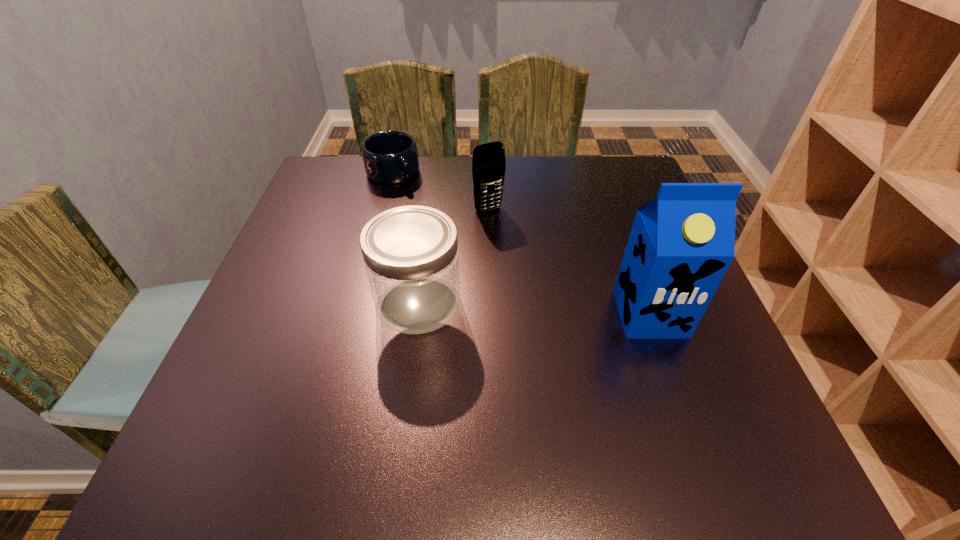
In order to click on jar in this screenshot , I will do `click(411, 257)`.

Where is `the rightmost object`? This screenshot has width=960, height=540. the rightmost object is located at coordinates (681, 244).

I want to click on carton, so click(x=681, y=244).

Locate an element on the screen. This screenshot has height=540, width=960. cellular telephone is located at coordinates (488, 161).

Locate an element on the screen. This screenshot has height=540, width=960. the third nearest object is located at coordinates (488, 161).

Locate an element on the screen. This screenshot has width=960, height=540. the farthest object is located at coordinates (390, 157).

You are a GUI agent. You are given a task and a screenshot of the screen. Output one action in this format:
    pyautogui.click(x=<x>, y=<y>)
    Task: Click on the mug
    
    Given the screenshot: What is the action you would take?
    pyautogui.click(x=390, y=157)

Locate an element on the screen. The image size is (960, 540). blank area located on the right of the jar is located at coordinates (520, 303).

Find the location of a particular element. This screenshot has height=540, width=960. vacant space positioned 0.070m with the cap open on the carton is located at coordinates (670, 371).

Identify the location of free region located on the screen of the cellular telephone. click(551, 291).